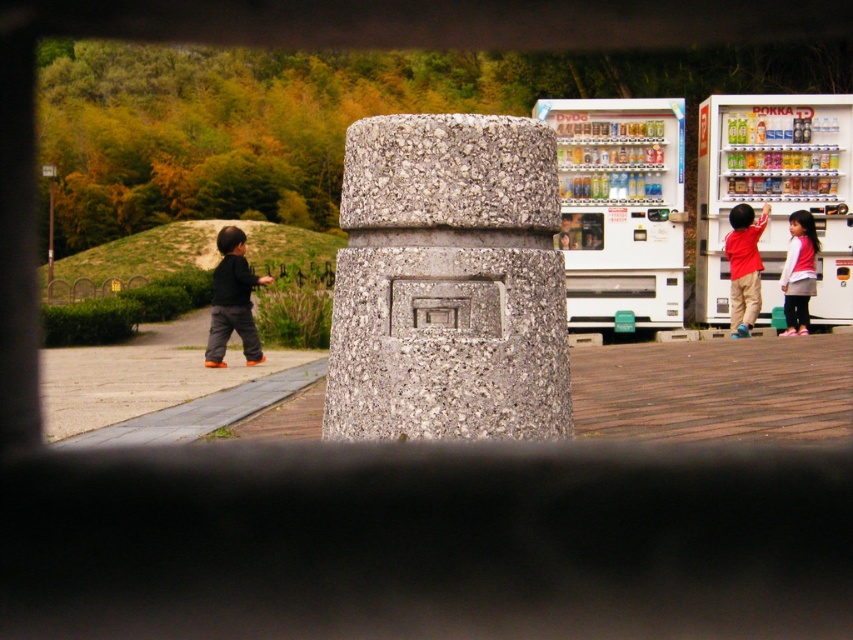
What do you see at coordinates (448, 282) in the screenshot?
I see `gray concrete pillar at center` at bounding box center [448, 282].

In the scene shown: Can you confirm if gray concrete pillar at center is positioned to the left of metallic white vending machine at right?

Indeed, gray concrete pillar at center is positioned on the left side of metallic white vending machine at right.

Which is in front, point (496, 378) or point (755, 163)?

Positioned in front is point (496, 378).

I want to click on gray concrete pillar at center, so click(448, 282).

Is metallic white vending machine at right shorter than white cotton shirt at right?

No, metallic white vending machine at right is not shorter than white cotton shirt at right.

Measure the distance from metallic white vending machine at right to white cotton shirt at right.

A distance of 32.65 inches exists between metallic white vending machine at right and white cotton shirt at right.

The height and width of the screenshot is (640, 853). What do you see at coordinates (775, 193) in the screenshot?
I see `metallic white vending machine at right` at bounding box center [775, 193].

Where is `metallic white vending machine at right`? This screenshot has height=640, width=853. metallic white vending machine at right is located at coordinates (775, 193).

Based on the photo, who is positioned more to the left, matte red shirt at right or white cotton shirt at right?

From the viewer's perspective, matte red shirt at right appears more on the left side.

Does point (747, 218) come farther from viewer compared to point (784, 332)?

Yes, point (747, 218) is behind point (784, 332).

Locate an element on the screen. matte red shirt at right is located at coordinates (744, 266).